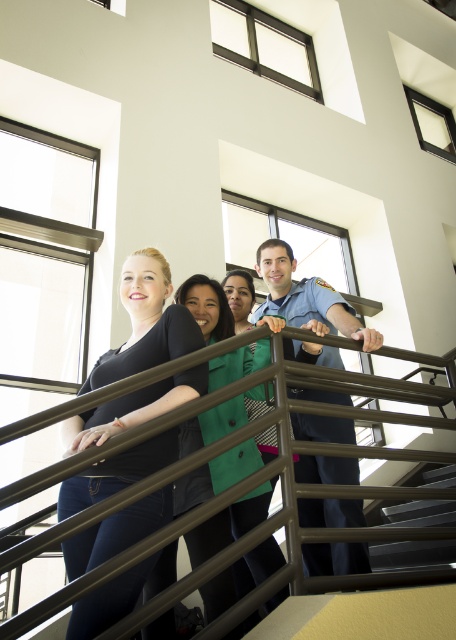
Question: Estimate the real-world distances between objects in this image. Which object is farther from the blue uniform at center?

Choices:
 (A) green fabric jacket at center
 (B) black matte shirt at center
 (C) metallic gray stairs at lower right
 (D) metallic brown railing at center

Answer: (C)

Question: Which of these objects is positioned closest to the green fabric jacket at center?

Choices:
 (A) black matte shirt at center
 (B) blue uniform at center
 (C) metallic brown railing at center

Answer: (B)

Question: Is metallic brown railing at center smaller than black matte shirt at center?

Choices:
 (A) no
 (B) yes

Answer: (A)

Question: Can you confirm if black matte shirt at center is smaller than green fabric jacket at center?

Choices:
 (A) yes
 (B) no

Answer: (A)

Question: Is metallic brown railing at center bigger than green fabric jacket at center?

Choices:
 (A) no
 (B) yes

Answer: (B)

Question: Among these objects, which one is farthest from the camera?

Choices:
 (A) metallic gray stairs at lower right
 (B) metallic brown railing at center
 (C) green fabric jacket at center
 (D) blue uniform at center

Answer: (A)